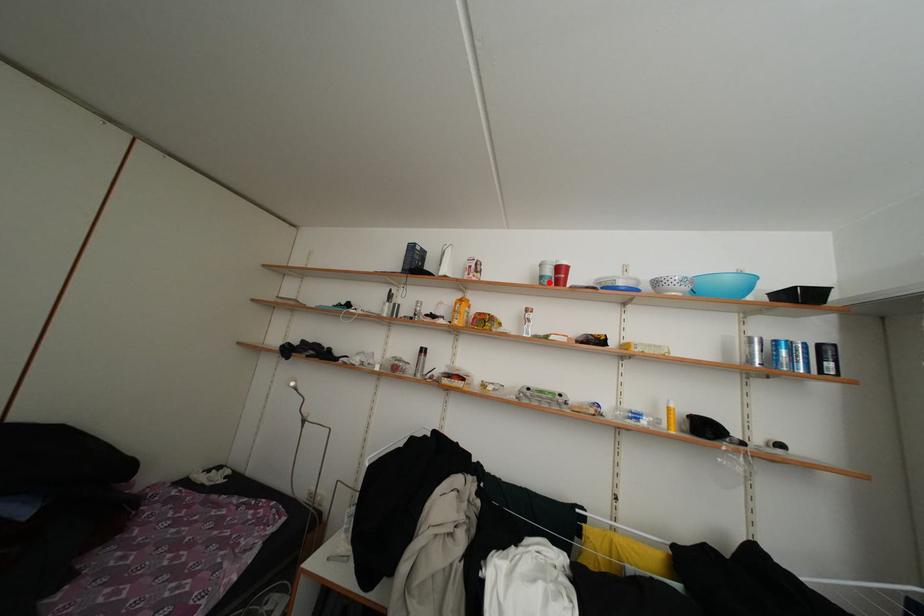
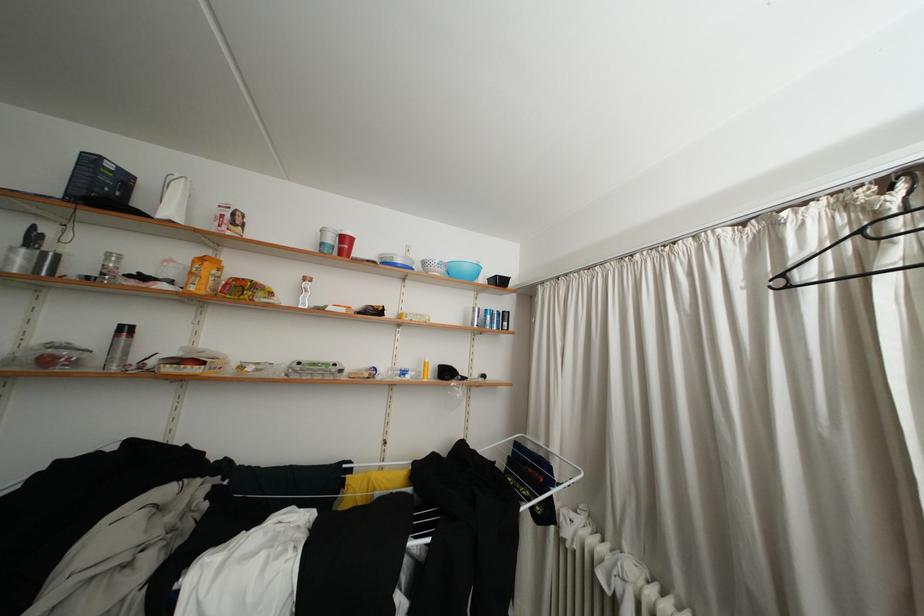
Locate, in the second image, the point that corresponds to the highlighted location in the first image.

(330, 249)